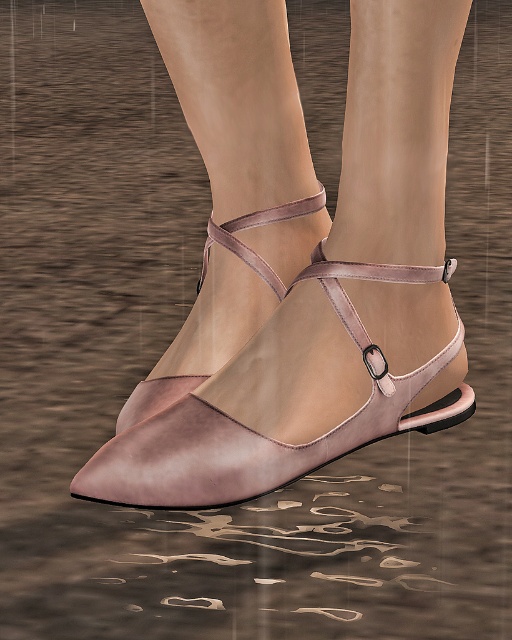
Question: Among these objects, which one is nearest to the camera?

Choices:
 (A) matte pink leather shoe at center
 (B) matte leather sandal at center

Answer: (B)

Question: Can you confirm if matte leather sandal at center is positioned to the left of matte pink leather strap at center?

Choices:
 (A) yes
 (B) no

Answer: (B)

Question: Can you confirm if matte pink leather shoe at center is smaller than matte pink leather strap at center?

Choices:
 (A) yes
 (B) no

Answer: (B)

Question: Which object is positioned closest to the matte pink leather strap at center?

Choices:
 (A) matte leather sandal at center
 (B) matte pink leather shoe at center

Answer: (B)

Question: Can you confirm if matte leather sandal at center is positioned to the right of matte pink leather shoe at center?

Choices:
 (A) yes
 (B) no

Answer: (A)

Question: Among these points, which one is farthest from the camera?

Choices:
 (A) (262, 276)
 (B) (308, 461)
 (C) (259, 216)

Answer: (C)